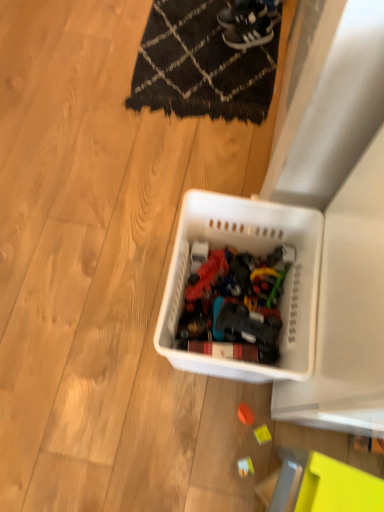
Locate an element on the screen. This screenshot has height=512, width=384. spots to the right of white leather sneakers at upper center, the first footwear from the bottom is located at coordinates 270,40.